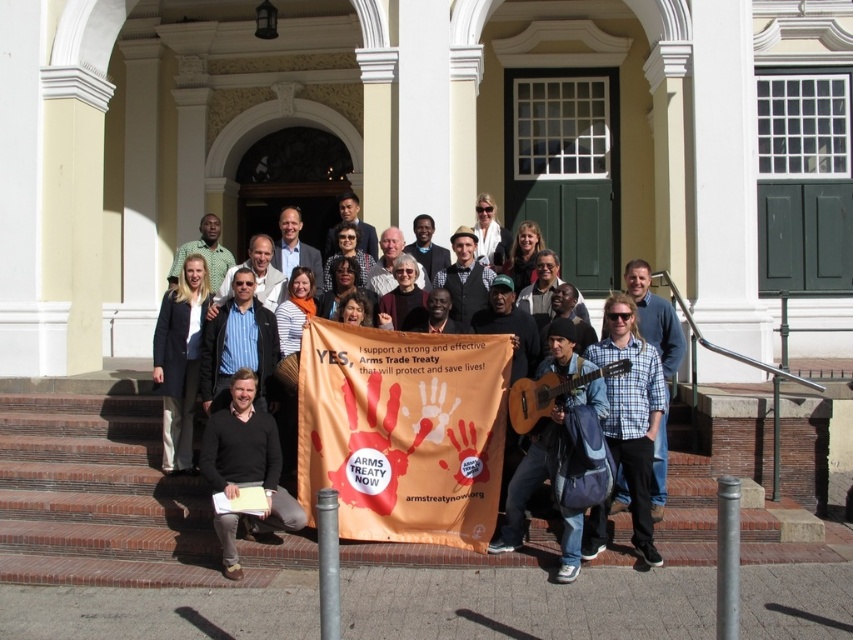
Is black sweater at center thinner than matte white shirt at center?

No.

Is black sweater at center positioned in front of matte white shirt at center?

Yes, black sweater at center is closer to the viewer.

Measure the distance between black sweater at center and camera.

The distance of black sweater at center from camera is 29.57 feet.

You are a GUI agent. You are given a task and a screenshot of the screen. Output one action in this format:
    pyautogui.click(x=<x>, y=<y>)
    Task: Click on the black sweater at center
    
    Given the screenshot: What is the action you would take?
    pyautogui.click(x=247, y=454)

Is matte black guitar at center smaller than matte white shirt at center?

Correct, matte black guitar at center occupies less space than matte white shirt at center.

Is matte black guitar at center shorter than matte white shirt at center?

Correct, matte black guitar at center is not as tall as matte white shirt at center.

I want to click on matte black guitar at center, so click(x=518, y=348).

Between point (479, 230) and point (341, 204), which one is positioned in front?

Positioned in front is point (479, 230).

Consider the image. Does matte white shirt at center have a smaller size compared to matte black shirt at center?

No.

Is point (486, 237) positioned after point (352, 204)?

No, it is in front of (352, 204).

At what (x,y) coordinates should I click in order to perform the action: click on matte white shirt at center. Please return your answer as a coordinate pair (x, y). Image resolution: width=853 pixels, height=640 pixels. Looking at the image, I should click on (490, 234).